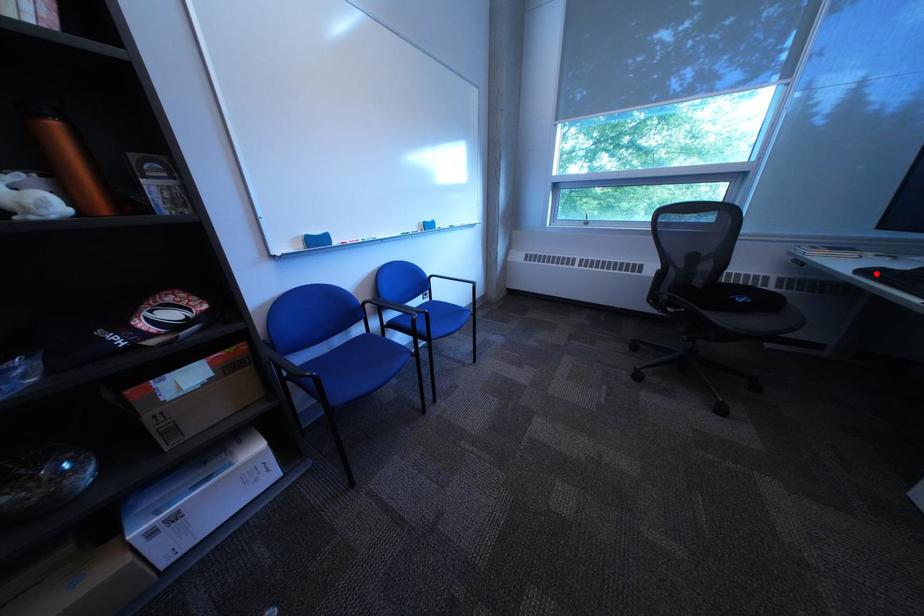
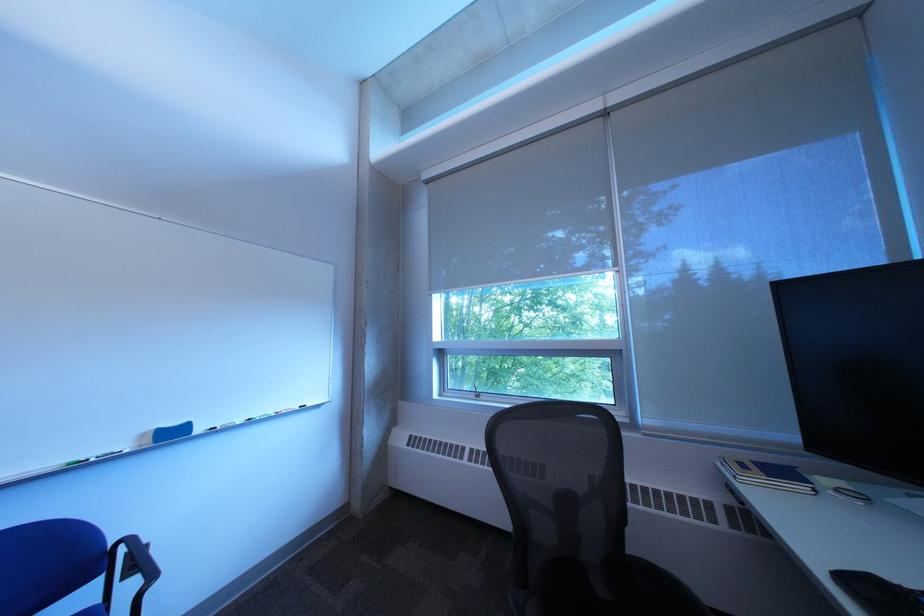
The point at the highlighted location is marked in the first image. Where is the corresponding point in the second image?

(860, 582)